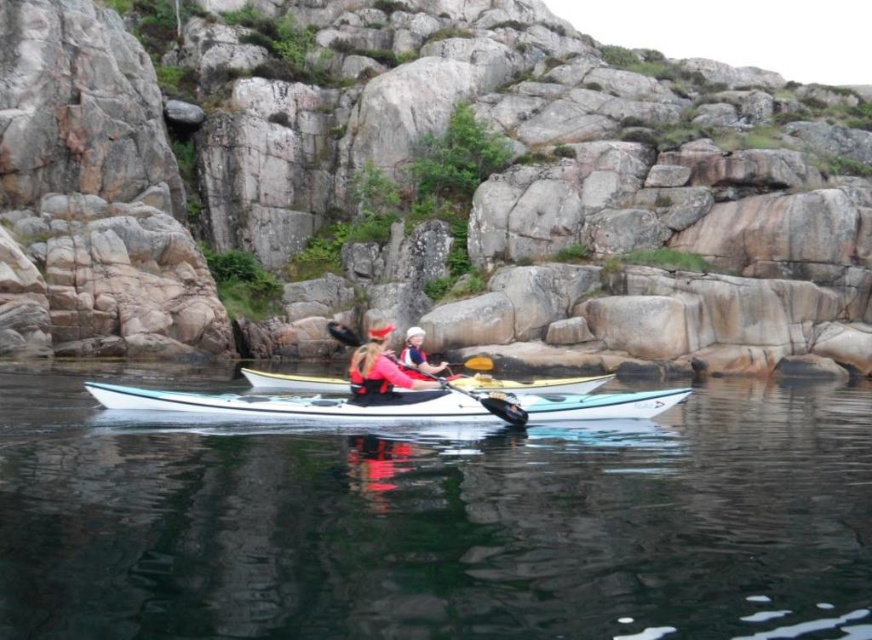
Who is more distant from viewer, [569,29] or [359,563]?

The point [569,29] is behind.

Identify the location of gray stone rock formation at center. (406, 180).

Is point (86, 289) more distant than point (76, 422)?

Yes, point (86, 289) is farther from viewer.

Find the location of a particular element. The height and width of the screenshot is (640, 872). gray stone rock formation at center is located at coordinates (406, 180).

Can you confirm if gray stone rock formation at center is positioned to the left of white glossy canoe at center?

Yes, gray stone rock formation at center is to the left of white glossy canoe at center.

Who is taller, gray stone rock formation at center or white glossy canoe at center?

With more height is gray stone rock formation at center.

The width and height of the screenshot is (872, 640). What do you see at coordinates (406, 180) in the screenshot?
I see `gray stone rock formation at center` at bounding box center [406, 180].

Where is `gray stone rock formation at center`? gray stone rock formation at center is located at coordinates (406, 180).

Looking at this image, between gray stone rock formation at center and white glossy kayak at center, which one has more height?

gray stone rock formation at center is taller.

The width and height of the screenshot is (872, 640). I want to click on gray stone rock formation at center, so click(x=406, y=180).

Locate an element on the screen. gray stone rock formation at center is located at coordinates (406, 180).

Locate an element on the screen. The height and width of the screenshot is (640, 872). gray stone rock formation at center is located at coordinates (406, 180).